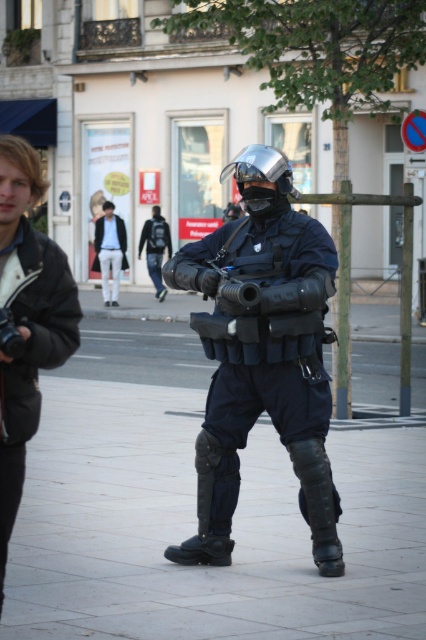
Is black rubber boots at center below black leather boot at lower center?

No.

Is point (152, 371) farther from camera compared to point (305, 465)?

Yes, point (152, 371) is farther from viewer.

Image resolution: width=426 pixels, height=640 pixels. I want to click on black rubber boots at center, so click(x=195, y=512).

Between black leather boot at center and metallic reflective helmet at center, which one appears on the left side from the viewer's perspective?

From the viewer's perspective, black leather boot at center appears more on the left side.

Does black leather boot at center appear over metallic reflective helmet at center?

No.

Is point (181, 554) more distant than point (244, 156)?

Yes, point (181, 554) is behind point (244, 156).

Find the location of `black leather boot at center`. black leather boot at center is located at coordinates (210, 506).

Can you confirm if black rubber boots at center is positioned below black leather jacket at left?

Correct, black rubber boots at center is located below black leather jacket at left.

Between black rubber boots at center and black leather jacket at left, which one appears on the right side from the viewer's perspective?

Positioned to the right is black rubber boots at center.

The height and width of the screenshot is (640, 426). I want to click on black rubber boots at center, so click(x=195, y=512).